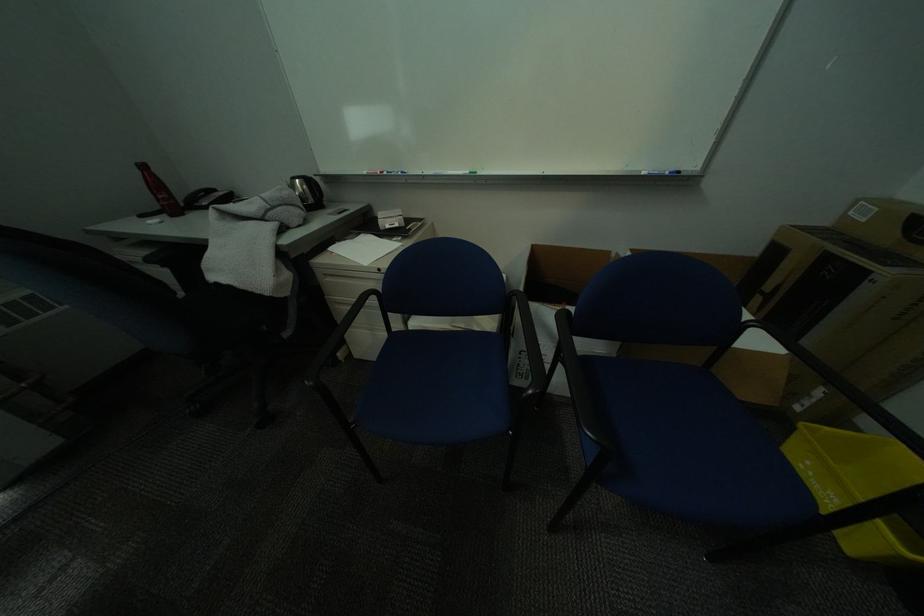
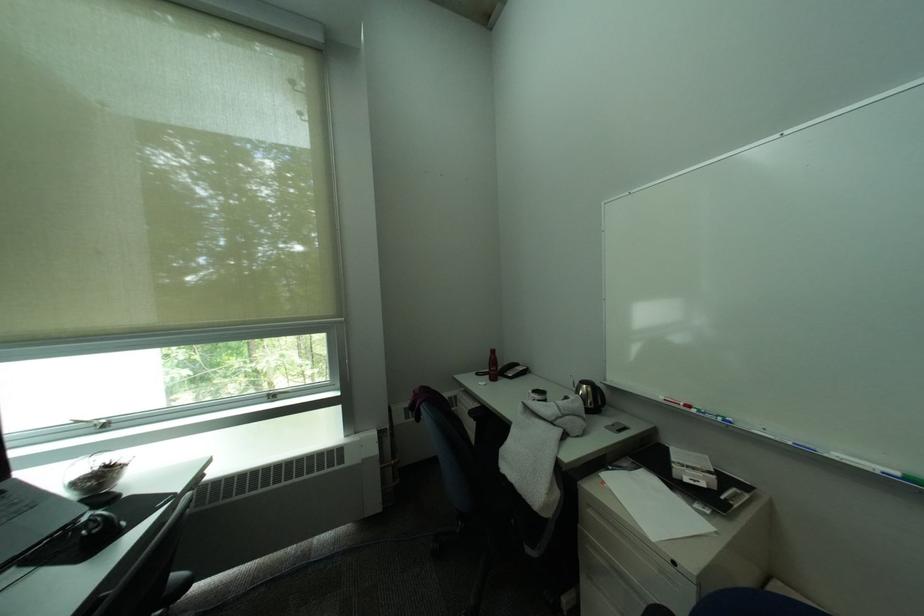
Locate, in the second image, the point that corresponds to (152,217) in the first image.

(488, 376)